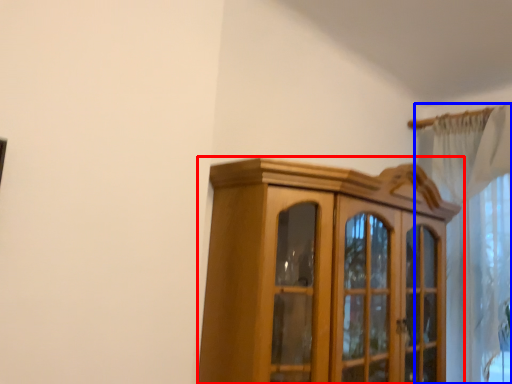
Question: Which object appears closest to the camera in this image, cupboard (highlighted by a red box) or curtain (highlighted by a blue box)?

Choices:
 (A) cupboard
 (B) curtain

Answer: (A)